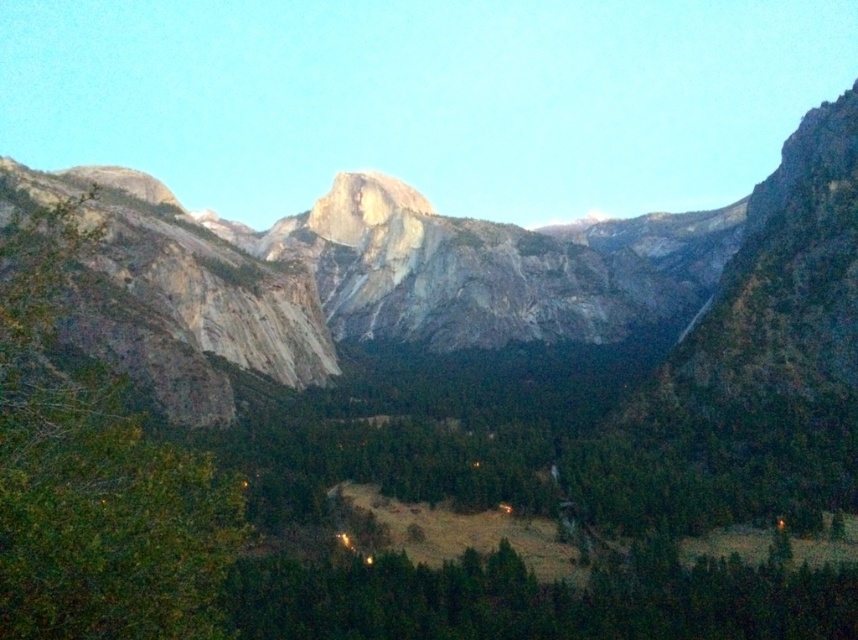
Question: Which point is closer to the camera?

Choices:
 (A) (224, 550)
 (B) (315, 564)

Answer: (A)

Question: Observing the image, what is the correct spatial positioning of green leafy tree at left in reference to green matte tree at lower center?

Choices:
 (A) below
 (B) above

Answer: (B)

Question: Where is green leafy tree at left located in relation to green matte tree at lower center in the image?

Choices:
 (A) left
 (B) right

Answer: (A)

Question: Can you confirm if green leafy tree at left is wider than green matte tree at lower center?

Choices:
 (A) yes
 (B) no

Answer: (B)